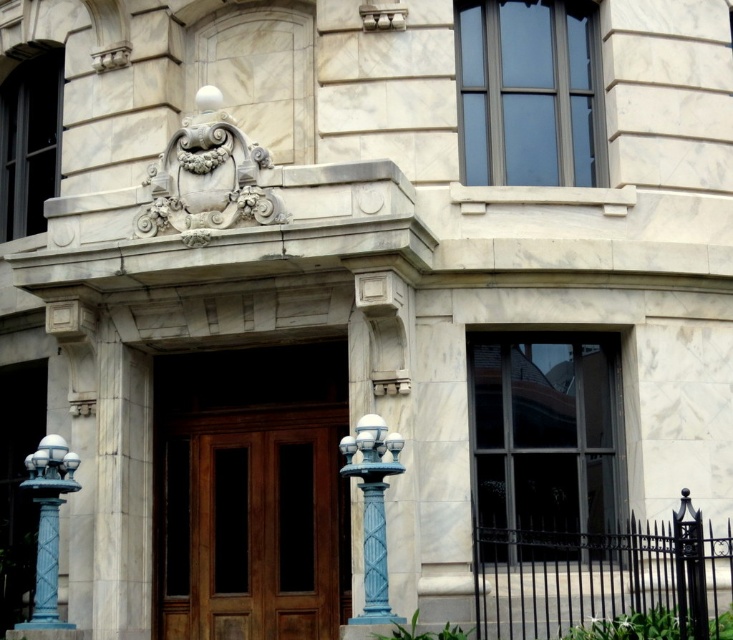
Between polished wood door at center and blue painted metal/texture lamp post at left, which one appears on the right side from the viewer's perspective?

Positioned to the right is polished wood door at center.

Which is above, polished wood door at center or blue painted metal/texture lamp post at left?

polished wood door at center is above.

Describe the element at coordinates (254, 525) in the screenshot. I see `polished wood door at center` at that location.

The image size is (733, 640). I want to click on polished wood door at center, so click(254, 525).

Can you confirm if blue glossy column at center is bigger than blue painted metal/texture lamp post at left?

No.

Can you confirm if blue glossy column at center is smaller than blue painted metal/texture lamp post at left?

Indeed, blue glossy column at center has a smaller size compared to blue painted metal/texture lamp post at left.

Locate an element on the screen. blue glossy column at center is located at coordinates (372, 508).

Does point (172, 547) lie in front of point (366, 552)?

No, (172, 547) is further to viewer.

Does point (226, 568) lie behind point (364, 467)?

Yes, point (226, 568) is farther from viewer.

Locate an element on the screen. The image size is (733, 640). polished wood door at center is located at coordinates (254, 525).